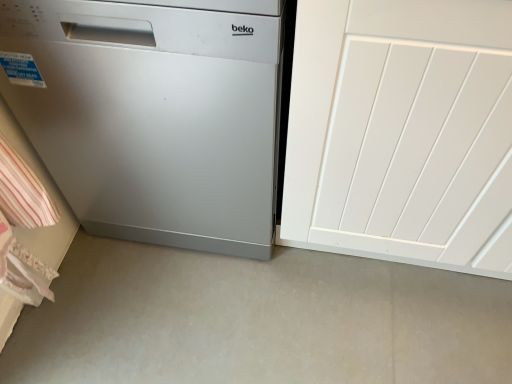
The width and height of the screenshot is (512, 384). What do you see at coordinates (402, 133) in the screenshot?
I see `white painted wood door at right` at bounding box center [402, 133].

At what (x,y) coordinates should I click in order to perform the action: click on white painted wood door at right. Please return your answer as a coordinate pair (x, y). Looking at the image, I should click on (402, 133).

Where is `satin silver dishwasher at left`? The image size is (512, 384). satin silver dishwasher at left is located at coordinates (153, 115).

What do you see at coordinates (153, 115) in the screenshot? This screenshot has width=512, height=384. I see `satin silver dishwasher at left` at bounding box center [153, 115].

Where is `white painted wood door at right`? Image resolution: width=512 pixels, height=384 pixels. white painted wood door at right is located at coordinates (402, 133).

Does white painted wood door at right appear on the left side of satin silver dishwasher at left?

No, white painted wood door at right is not to the left of satin silver dishwasher at left.

Is white painted wood door at right further to camera compared to satin silver dishwasher at left?

No, white painted wood door at right is in front of satin silver dishwasher at left.

Is point (490, 23) closer to viewer compared to point (96, 160)?

That is True.

From the image's perspective, relative to satin silver dishwasher at left, is white painted wood door at right above or below?

white painted wood door at right is situated lower than satin silver dishwasher at left in the image.

From a real-world perspective, between white painted wood door at right and satin silver dishwasher at left, who is vertically higher?

From a 3D spatial view, white painted wood door at right is above.

Which object is thinner, white painted wood door at right or satin silver dishwasher at left?

satin silver dishwasher at left.

Considering the relative sizes of white painted wood door at right and satin silver dishwasher at left in the image provided, is white painted wood door at right shorter than satin silver dishwasher at left?

No, white painted wood door at right is not shorter than satin silver dishwasher at left.

Can you confirm if white painted wood door at right is bigger than satin silver dishwasher at left?

Yes, white painted wood door at right is bigger than satin silver dishwasher at left.

Choose the correct answer: Is white painted wood door at right inside satin silver dishwasher at left or outside it?

The correct answer is: outside.

Would you consider white painted wood door at right to be distant from satin silver dishwasher at left?

white painted wood door at right is actually quite close to satin silver dishwasher at left.

Is white painted wood door at right positioned with its back to satin silver dishwasher at left?

No.

What's the angular difference between white painted wood door at right and satin silver dishwasher at left's facing directions?

The facing directions of white painted wood door at right and satin silver dishwasher at left are 0.000144 degrees apart.

How far apart are white painted wood door at right and satin silver dishwasher at left?

They are 11.31 inches apart.

Where is `home appliance that appears behind the white painted wood door at right`? This screenshot has width=512, height=384. home appliance that appears behind the white painted wood door at right is located at coordinates (153, 115).

Which object is positioned more to the left, satin silver dishwasher at left or white painted wood door at right?

Positioned to the left is satin silver dishwasher at left.

Relative to white painted wood door at right, is satin silver dishwasher at left in front or behind?

Visually, satin silver dishwasher at left is located behind white painted wood door at right.

Does point (159, 20) lie in front of point (464, 167)?

Yes, point (159, 20) is closer to viewer.

From the image's perspective, is satin silver dishwasher at left beneath white painted wood door at right?

No.

From a real-world perspective, which object stands above the other?

In real-world perspective, white painted wood door at right is above.

Which of these two, satin silver dishwasher at left or white painted wood door at right, is wider?

white painted wood door at right.

Can you confirm if satin silver dishwasher at left is shorter than white painted wood door at right?

Yes, satin silver dishwasher at left is shorter than white painted wood door at right.

Does satin silver dishwasher at left have a smaller size compared to white painted wood door at right?

Yes.

Does satin silver dishwasher at left contain white painted wood door at right?

No, white painted wood door at right is not a part of satin silver dishwasher at left.

Is satin silver dishwasher at left next to white painted wood door at right and touching it?

satin silver dishwasher at left and white painted wood door at right are not in contact.

Is satin silver dishwasher at left aimed at white painted wood door at right?

No, satin silver dishwasher at left is not facing towards white painted wood door at right.

Locate an element on the screen. This screenshot has height=384, width=512. home appliance above the white painted wood door at right (from the image's perspective) is located at coordinates (153, 115).

Locate an element on the screen. door in front of the satin silver dishwasher at left is located at coordinates coord(402,133).

The width and height of the screenshot is (512, 384). I want to click on home appliance lying behind the white painted wood door at right, so click(153, 115).